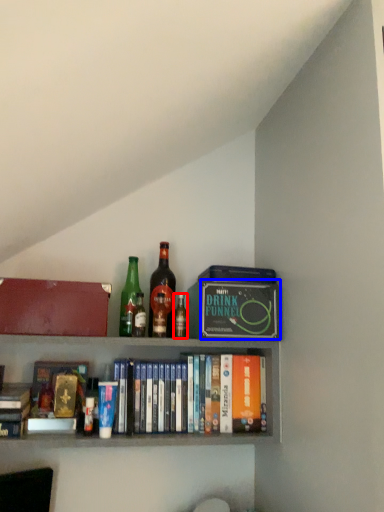
Question: Among these objects, which one is farthest to the camera, bottle (highlighted by a red box) or paperback book (highlighted by a blue box)?

Choices:
 (A) bottle
 (B) paperback book

Answer: (A)